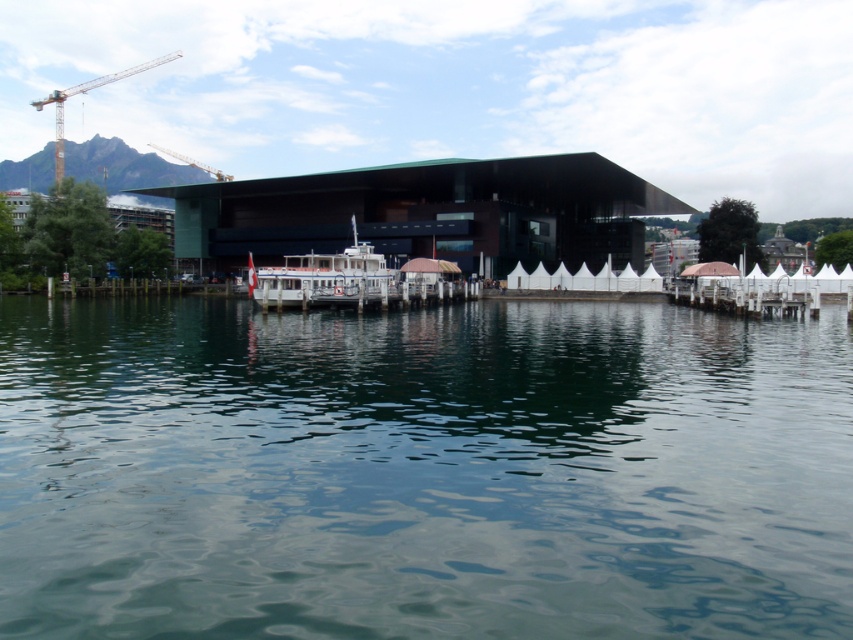
Question: From the image, what is the correct spatial relationship of white matte boat at center in relation to yellow metal crane at upper left?

Choices:
 (A) below
 (B) above

Answer: (A)

Question: Can you confirm if green liquid water at center is thinner than white matte boat at center?

Choices:
 (A) yes
 (B) no

Answer: (B)

Question: Considering the relative positions of green liquid water at center and white matte boat at center in the image provided, where is green liquid water at center located with respect to white matte boat at center?

Choices:
 (A) left
 (B) right

Answer: (B)

Question: Which point is closer to the camera?

Choices:
 (A) green liquid water at center
 (B) yellow metal crane at upper left

Answer: (A)

Question: Which point is farther to the camera?

Choices:
 (A) white matte boat at center
 (B) metallic construction crane at upper left
 (C) yellow metal crane at upper left
 (D) green liquid water at center

Answer: (B)

Question: Which object appears farthest from the camera in this image?

Choices:
 (A) green liquid water at center
 (B) metallic construction crane at upper left
 (C) yellow metal crane at upper left
 (D) white matte boat at center

Answer: (B)